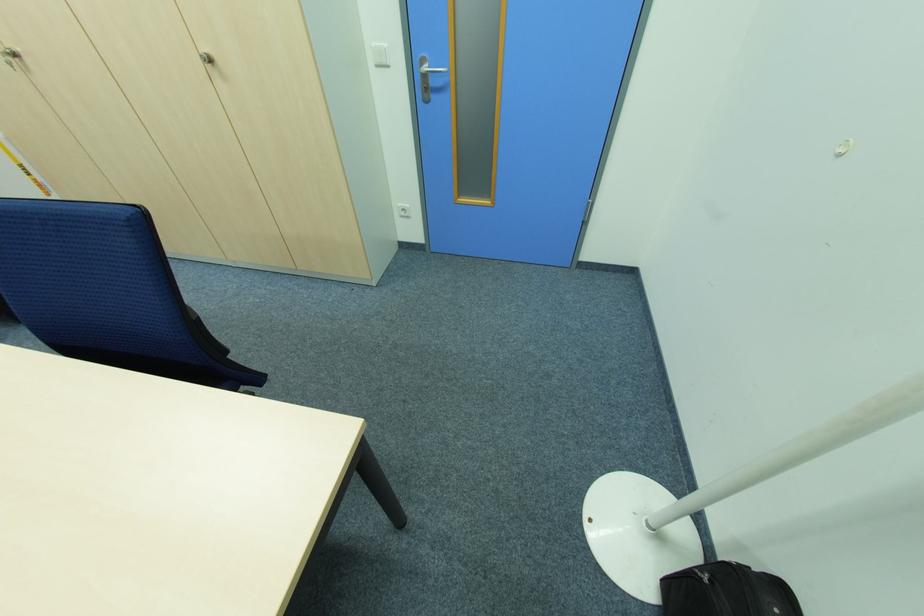
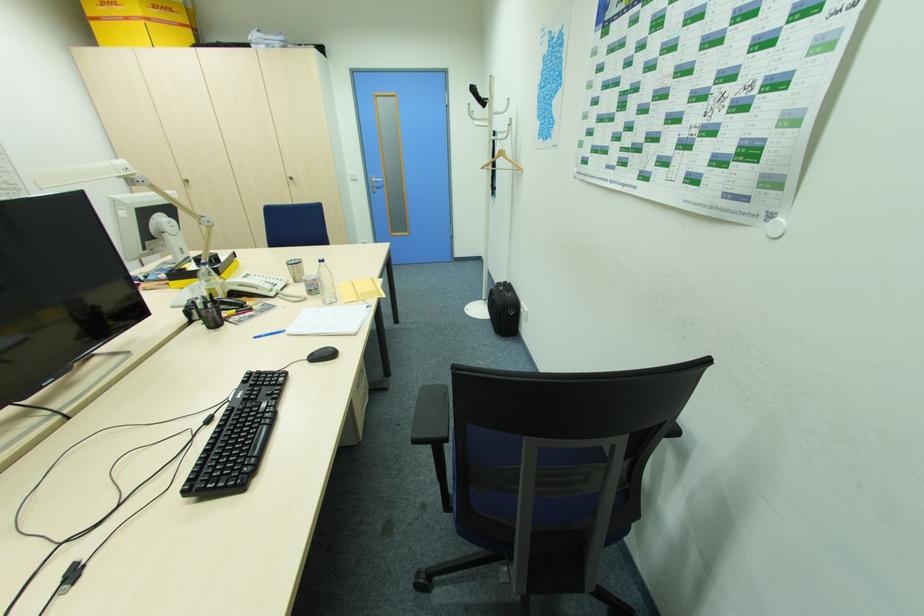
Question: In a continuous first-person perspective shot, in which direction is the camera moving?

Choices:
 (A) Left
 (B) Right
 (C) Forward
 (D) Backward

Answer: (D)